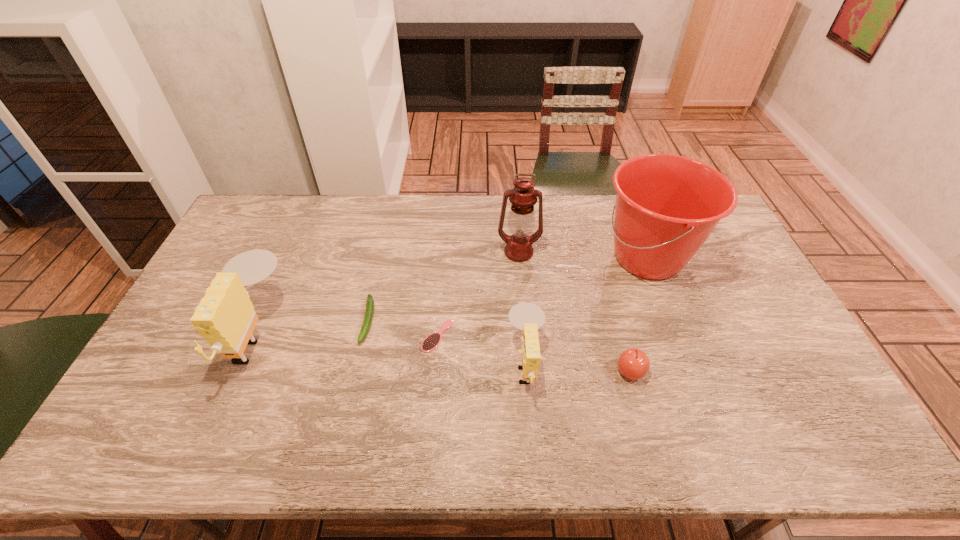
This screenshot has width=960, height=540. I want to click on vacant region located with the handle attached to the rim of the bucket, so click(x=537, y=258).

Locate an element on the screen. vacant position located on the front-facing side of the zucchini is located at coordinates (355, 377).

You are a GUI agent. You are given a task and a screenshot of the screen. Output one action in this format:
    pyautogui.click(x=<x>, y=<y>)
    Task: Click on the vacant space located 0.060m on the right of the third object from left to right
    
    Given the screenshot: What is the action you would take?
    pyautogui.click(x=473, y=336)

Identify the location of free point located 0.300m on the right of the apple. The image size is (960, 540). (757, 372).

The height and width of the screenshot is (540, 960). What are the coordinates of `object located at the far edge` in the screenshot? It's located at (666, 206).

Image resolution: width=960 pixels, height=540 pixels. Identify the location of apple that is at the near edge. (634, 364).

Locate an element on the screen. The image size is (960, 540). object located at the right edge is located at coordinates (666, 206).

Image resolution: width=960 pixels, height=540 pixels. I want to click on object that is at the far right corner, so click(x=666, y=206).

This screenshot has height=540, width=960. I want to click on vacant point at the far edge, so click(x=392, y=217).

Find the location of a particular element. The width and height of the screenshot is (960, 540). vacant area at the right edge of the desktop is located at coordinates (744, 354).